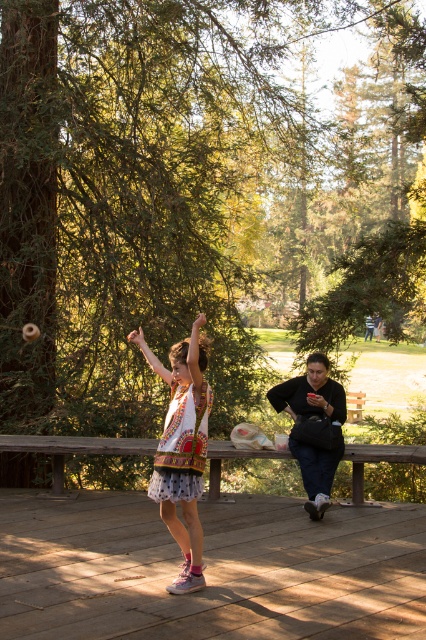
Question: Which of the following is the closest to the observer?

Choices:
 (A) wooden bench at center
 (B) dark blue sweater at center
 (C) white printed dress at center

Answer: (C)

Question: Where is wooden deck at lower center located in relation to wooden bench at center in the image?

Choices:
 (A) below
 (B) above

Answer: (A)

Question: Is white printed dress at center smaller than dark blue sweater at center?

Choices:
 (A) yes
 (B) no

Answer: (B)

Question: Can you confirm if white printed dress at center is positioned to the left of wooden bench at center?

Choices:
 (A) no
 (B) yes

Answer: (A)

Question: Based on their relative distances, which object is nearer to the wooden deck at lower center?

Choices:
 (A) dark blue sweater at center
 (B) wooden bench at center

Answer: (A)

Question: Which point appears farthest from the camera in this image?

Choices:
 (A) (379, 444)
 (B) (382, 616)
 (C) (160, 461)

Answer: (A)